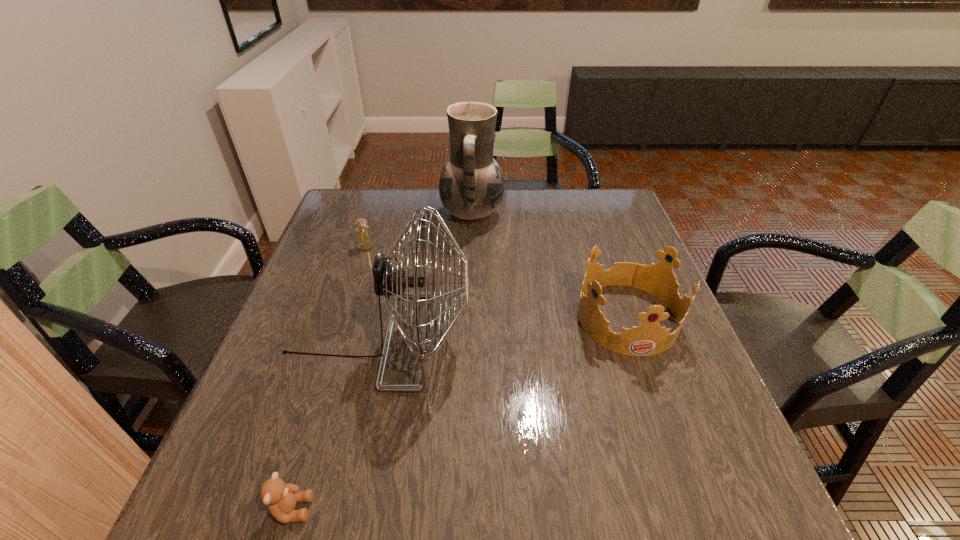
Identify the location of vacant area between the nearest object and the rightmost object. The height and width of the screenshot is (540, 960). (460, 413).

Select which object is the closest to the teddy bear. Please provide its 2D coordinates. Your answer should be formatted as a tuple, i.e. [(x, y)], where the tuple contains the x and y coordinates of a point satisfying the conditions above.

[(389, 282)]

The width and height of the screenshot is (960, 540). Find the location of `object that is the third closest to the pitcher`. object that is the third closest to the pitcher is located at coordinates pyautogui.click(x=648, y=339).

This screenshot has height=540, width=960. I want to click on free spot that satisfies the following two spatial constraints: 1. on the front-facing side of the tiara; 2. on the front-facing side of the fan, so click(635, 340).

I want to click on vacant space that satisfies the following two spatial constraints: 1. on the front-facing side of the third tallest object; 2. on the front-facing side of the nearest object, so click(x=693, y=509).

Where is `vacant space that satisfies the following two spatial constraints: 1. on the front-facing side of the third shortest object; 2. on the front-facing side of the teddy bear`? vacant space that satisfies the following two spatial constraints: 1. on the front-facing side of the third shortest object; 2. on the front-facing side of the teddy bear is located at coordinates (693, 509).

At what (x,y) coordinates should I click in order to perform the action: click on blank area in the image that satisfies the following two spatial constraints: 1. on the front-facing side of the tiara; 2. on the front-facing side of the fan. Please return your answer as a coordinate pair (x, y). Image resolution: width=960 pixels, height=540 pixels. Looking at the image, I should click on (635, 340).